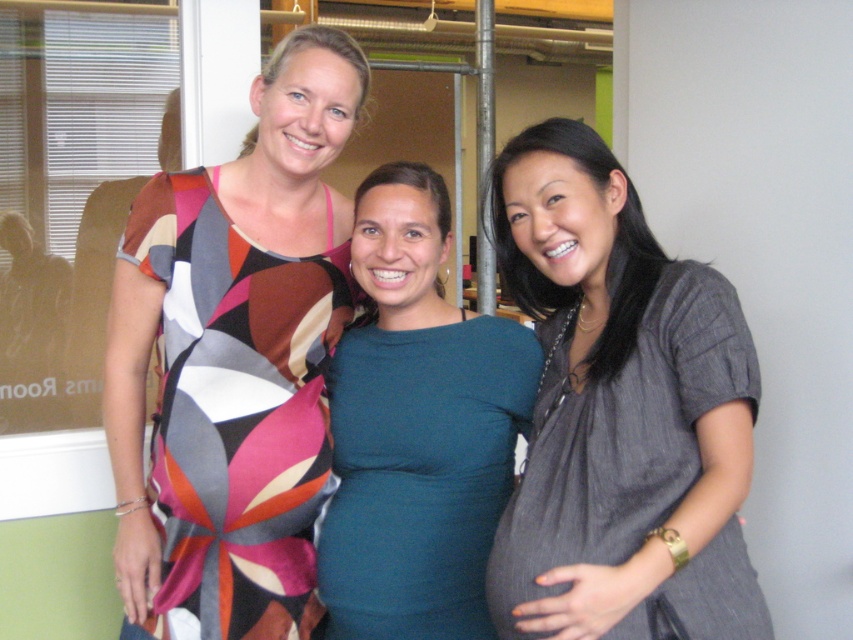
Is point (705, 312) positioned in front of point (293, 412)?

Yes, it is.

The width and height of the screenshot is (853, 640). In order to click on gray textured dress at center in this screenshot , I will do `click(618, 410)`.

Is gray textured dress at center closer to the viewer compared to teal jersey dress at center?

Yes, it is in front of teal jersey dress at center.

Between point (639, 605) and point (351, 372), which one is positioned behind?

Positioned behind is point (351, 372).

What do you see at coordinates (618, 410) in the screenshot?
I see `gray textured dress at center` at bounding box center [618, 410].

Find the location of `gray textured dress at center`. gray textured dress at center is located at coordinates (618, 410).

Which is more to the left, multicolored fabric dress at left or teal jersey dress at center?

multicolored fabric dress at left

Can you confirm if multicolored fabric dress at left is thinner than teal jersey dress at center?

No.

The height and width of the screenshot is (640, 853). Find the location of `multicolored fabric dress at left`. multicolored fabric dress at left is located at coordinates [236, 412].